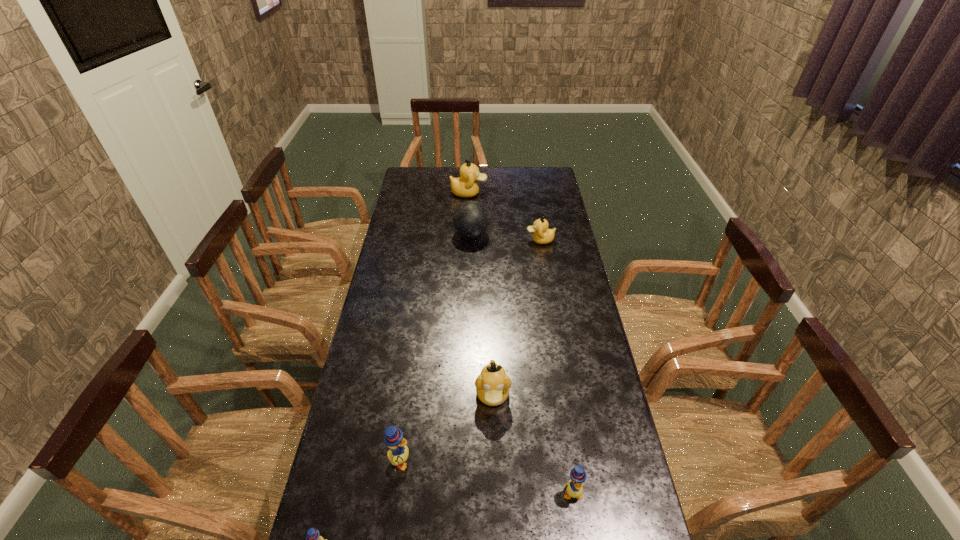
The width and height of the screenshot is (960, 540). In order to click on the rightmost yellow duckling in this screenshot , I will do `click(574, 488)`.

You are a GUI agent. You are given a task and a screenshot of the screen. Output one action in this format:
    pyautogui.click(x=<x>, y=<y>)
    Task: Click on the vacant area situated on the face of the biggest tan duckling
    
    Given the screenshot: What is the action you would take?
    pyautogui.click(x=540, y=193)

In order to click on vacant space situated 0.160m on the grip area of the bowling ball in this screenshot , I will do `click(526, 234)`.

You are a GUI agent. You are given a task and a screenshot of the screen. Output one action in this format:
    pyautogui.click(x=<x>, y=<y>)
    Task: Click on the vacant point located on the face of the fifth farthest object, where the monocle is placed
    
    Given the screenshot: What is the action you would take?
    pyautogui.click(x=434, y=461)

This screenshot has width=960, height=540. I want to click on free space located 0.090m on the face of the fourth nearest duckling, so click(493, 449).

Identify the location of vacant region located 0.320m on the face of the smallest tan duckling. (450, 240).

Where is `free spot located 0.350m on the face of the smallest tan duckling`? The image size is (960, 540). free spot located 0.350m on the face of the smallest tan duckling is located at coordinates (444, 240).

Where is `blank space located 0.100m on the face of the smallest tan duckling`? blank space located 0.100m on the face of the smallest tan duckling is located at coordinates (502, 240).

Identify the location of object present at the far edge. The image size is (960, 540). (465, 186).

Locate an element on the screen. The height and width of the screenshot is (540, 960). object situated at the left edge is located at coordinates (398, 454).